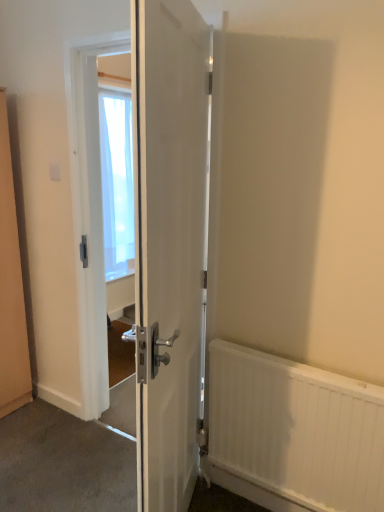
Question: Is white plastic electric outlet at upper left not inside white textured radiator at lower right?

Choices:
 (A) yes
 (B) no

Answer: (A)

Question: From the image's perspective, is white plastic electric outlet at upper left on white textured radiator at lower right?

Choices:
 (A) no
 (B) yes

Answer: (B)

Question: Does white plastic electric outlet at upper left have a larger size compared to white textured radiator at lower right?

Choices:
 (A) no
 (B) yes

Answer: (A)

Question: From a real-world perspective, is white plastic electric outlet at upper left positioned under white textured radiator at lower right based on gravity?

Choices:
 (A) yes
 (B) no

Answer: (B)

Question: Is white plastic electric outlet at upper left turned away from white textured radiator at lower right?

Choices:
 (A) yes
 (B) no

Answer: (B)

Question: In the image, is white textured radiator at lower right positioned in front of or behind white glossy door at center?

Choices:
 (A) behind
 (B) front

Answer: (A)

Question: Looking at their shapes, would you say white textured radiator at lower right is wider or thinner than white glossy door at center?

Choices:
 (A) wide
 (B) thin

Answer: (B)

Question: From the image's perspective, is white textured radiator at lower right above or below white glossy door at center?

Choices:
 (A) below
 (B) above

Answer: (A)

Question: Does point (271, 500) appear closer or farther from the camera than point (148, 183)?

Choices:
 (A) closer
 (B) farther

Answer: (B)

Question: From a real-world perspective, is white glossy door at center positioned above or below white plastic electric outlet at upper left?

Choices:
 (A) above
 (B) below

Answer: (B)

Question: Looking at their shapes, would you say white glossy door at center is wider or thinner than white plastic electric outlet at upper left?

Choices:
 (A) wide
 (B) thin

Answer: (A)

Question: Is white glossy door at center taller or shorter than white plastic electric outlet at upper left?

Choices:
 (A) short
 (B) tall

Answer: (B)

Question: Is white glossy door at center bigger or smaller than white plastic electric outlet at upper left?

Choices:
 (A) small
 (B) big

Answer: (B)

Question: From the image's perspective, is transparent fabric at center positioned above or below white textured radiator at lower right?

Choices:
 (A) below
 (B) above

Answer: (B)

Question: In terms of height, does transparent fabric at center look taller or shorter compared to white textured radiator at lower right?

Choices:
 (A) short
 (B) tall

Answer: (B)